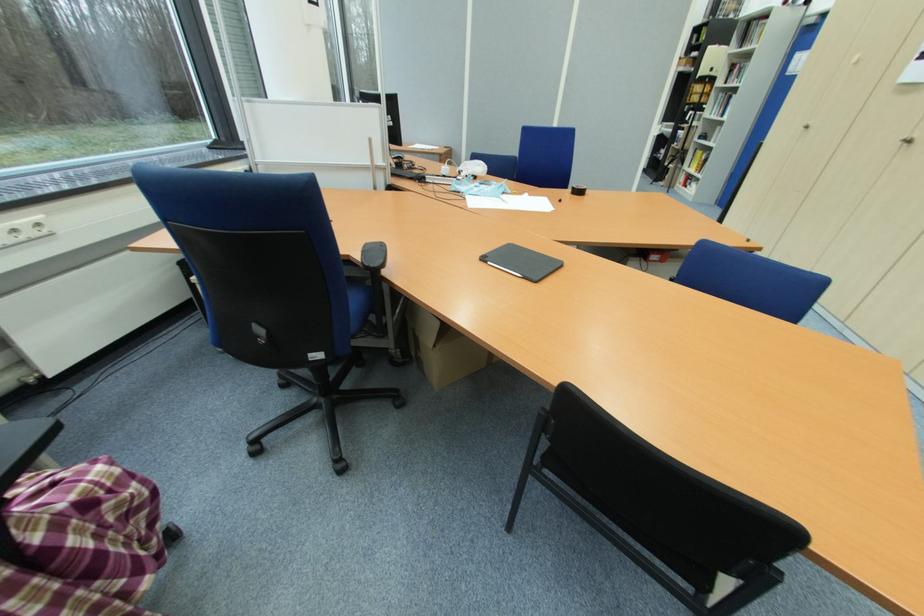
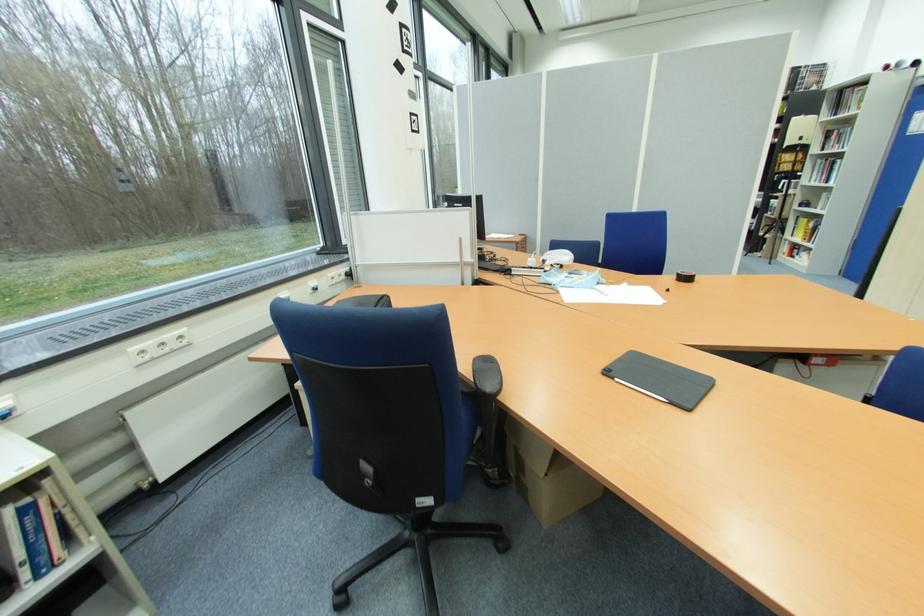
The images are taken continuously from a first-person perspective. In which direction are you moving?

The cameraman moved toward left, forward.